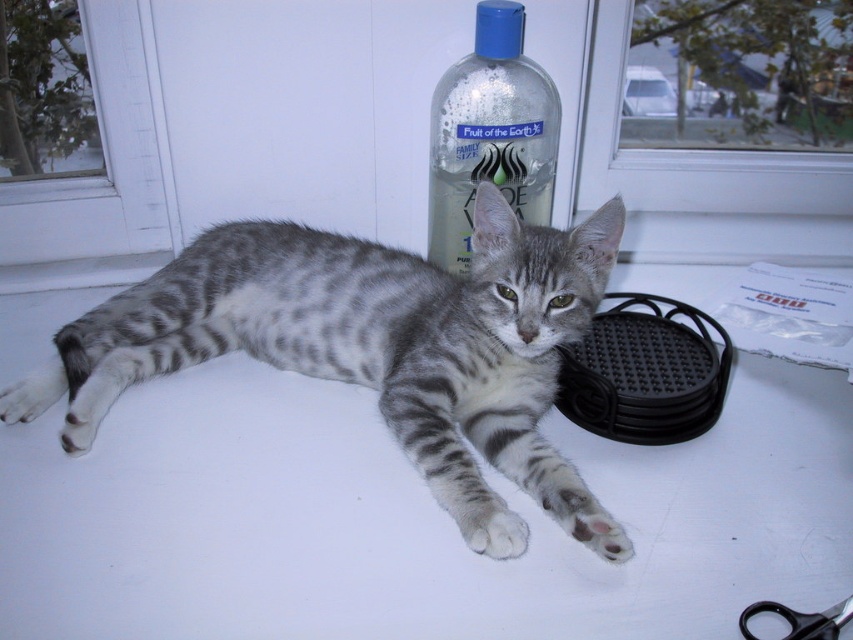
You are standing in front of the cat lying on its side on a white surface. You notice two points marked in the image. Which point is closer to you, point (531, 90) or point (10, 38)?

Point (531, 90) is in front of point (10, 38), so it is closer to you.

You are a photographer adjusting your camera to focus on two points in the image. The first point is point (538, 497) and the second is point (840, 627). Which point is closer to the camera?

Point (538, 497) is closer to the camera than point (840, 627).